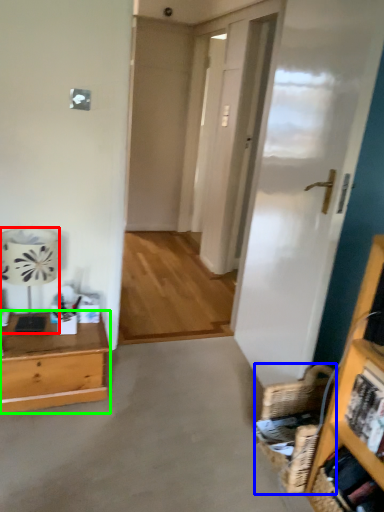
Question: Which object is positioned closest to lamp (highlighted by a red box)? Select from basket (highlighted by a blue box) and desk (highlighted by a green box).

Choices:
 (A) basket
 (B) desk

Answer: (B)